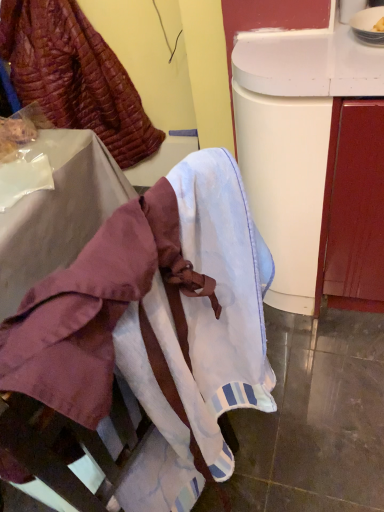
Question: Is velvet-like burgundy fabric at upper left to the left or to the right of white cotton towel at lower center in the image?

Choices:
 (A) right
 (B) left

Answer: (B)

Question: Considering the positions of point (114, 84) and point (187, 409), is point (114, 84) closer or farther from the camera than point (187, 409)?

Choices:
 (A) closer
 (B) farther

Answer: (B)

Question: Looking at their shapes, would you say velvet-like burgundy fabric at upper left is wider or thinner than white cotton towel at lower center?

Choices:
 (A) thin
 (B) wide

Answer: (B)

Question: Is point click(x=168, y=254) closer or farther from the camera than point click(x=61, y=73)?

Choices:
 (A) farther
 (B) closer

Answer: (B)

Question: Is white cotton towel at lower center wider or thinner than velvet-like burgundy fabric at upper left?

Choices:
 (A) thin
 (B) wide

Answer: (A)

Question: From the image's perspective, is white cotton towel at lower center positioned above or below velvet-like burgundy fabric at upper left?

Choices:
 (A) below
 (B) above

Answer: (A)

Question: Is white cotton towel at lower center in front of or behind velvet-like burgundy fabric at upper left in the image?

Choices:
 (A) front
 (B) behind

Answer: (A)